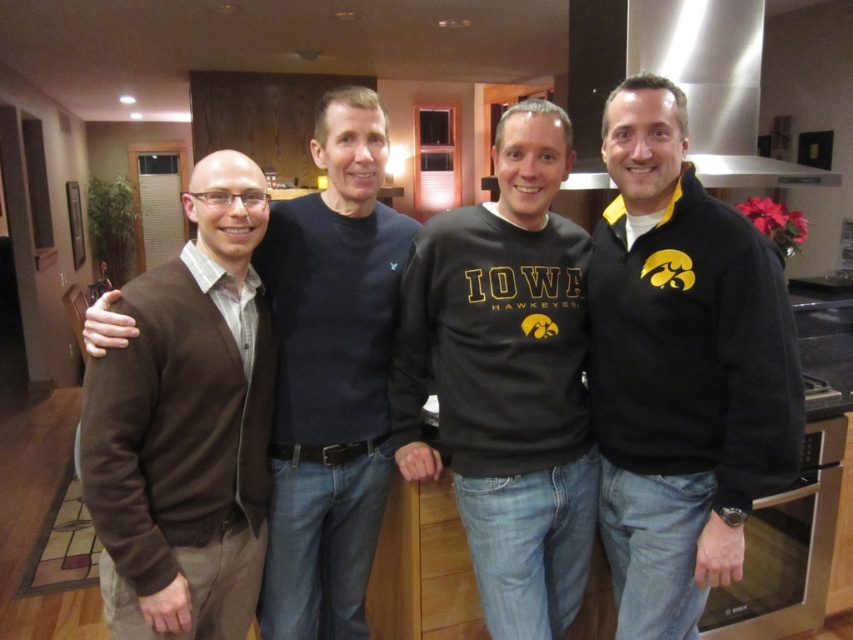
You are organizing a clothing donation drive and need to know which item takes up more space in the donation bin. Based on the image, which item between the black fleece sweatshirt at right and the brown sweater at left should be placed first to optimize space?

The brown sweater at left occupies more space than the black fleece sweatshirt at right, so it should be placed first in the donation bin to optimize space.

You are a photographer trying to capture a group photo of the four men in the kitchen. The brown cardigan at left and the stainless steel exhaust hood at upper right are both in the frame. Based on their heights, which object should you adjust your camera angle to focus on to ensure both are fully visible in the photo?

The brown cardigan at left is much taller than the stainless steel exhaust hood at upper right, so you should adjust your camera angle to focus on the brown cardigan at left to ensure both are fully visible in the photo.